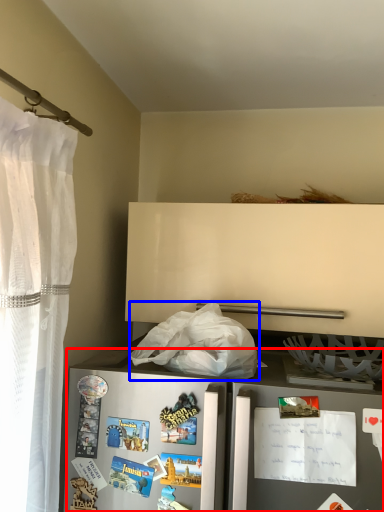
Question: Which of the following is the farthest to the observer, refrigerator (highlighted by a red box) or plastic bag (highlighted by a blue box)?

Choices:
 (A) refrigerator
 (B) plastic bag

Answer: (B)